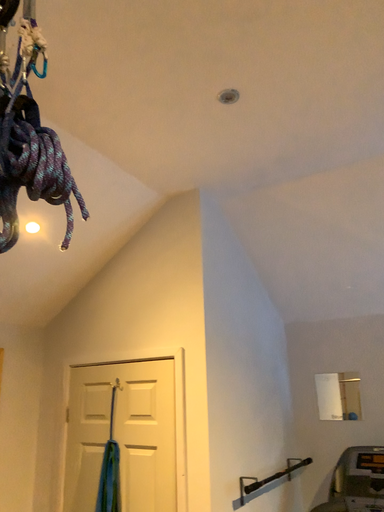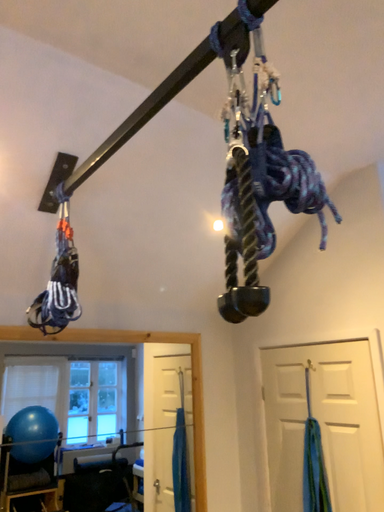
Question: Which way did the camera rotate in the video?

Choices:
 (A) rotated right
 (B) rotated left

Answer: (B)